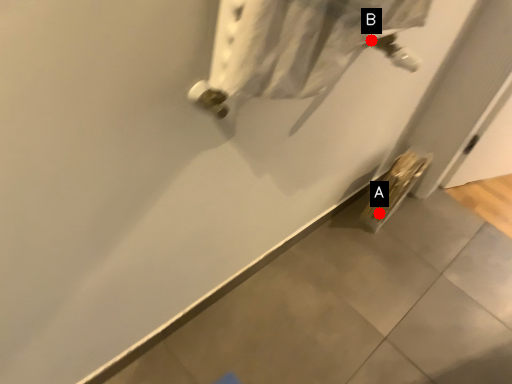
Question: Two points are circled on the image, labeled by A and B beside each circle. Which point is further to the camera?

Choices:
 (A) A is further
 (B) B is further

Answer: (A)